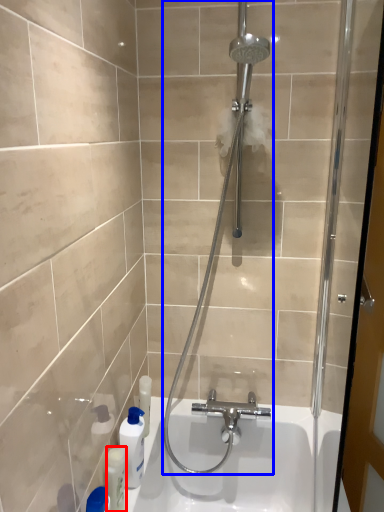
Question: Which of the following is the farthest to the observer, toiletry (highlighted by a red box) or shower (highlighted by a blue box)?

Choices:
 (A) toiletry
 (B) shower

Answer: (A)